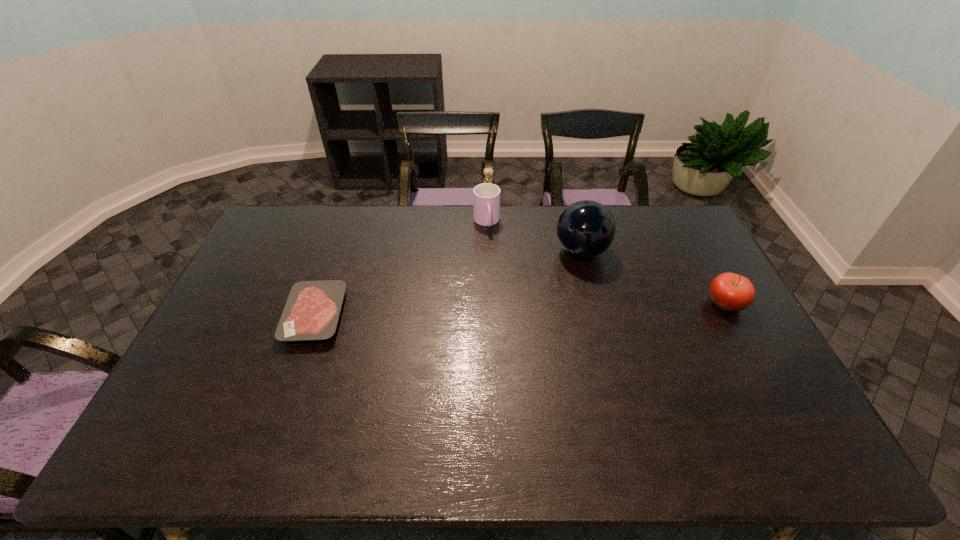
Find the location of `blank space located with the handle on the side of the third object from right to left`. blank space located with the handle on the side of the third object from right to left is located at coordinates (500, 301).

Locate an element on the screen. The height and width of the screenshot is (540, 960). vacant region located 0.100m on the side of the bowling ball with the finger holes is located at coordinates (564, 287).

You are a GUI agent. You are given a task and a screenshot of the screen. Output one action in this format:
    pyautogui.click(x=<x>, y=<y>)
    Task: Click on the vacant position located 0.390m on the side of the bowling ball with the finger holes
    The image size is (960, 540).
    Given the screenshot: What is the action you would take?
    pyautogui.click(x=531, y=352)

Where is `vacant position located 0.120m on the side of the bowling ball with the finger holes`? The image size is (960, 540). vacant position located 0.120m on the side of the bowling ball with the finger holes is located at coordinates (562, 291).

Identify the location of cup located at the far edge. This screenshot has height=540, width=960. (486, 197).

Locate an element on the screen. Image resolution: width=960 pixels, height=540 pixels. bowling ball that is at the far edge is located at coordinates (585, 229).

Where is `object that is at the right edge`? object that is at the right edge is located at coordinates (730, 292).

Where is `free space at the far edge of the desktop`? The image size is (960, 540). free space at the far edge of the desktop is located at coordinates (340, 243).

Image resolution: width=960 pixels, height=540 pixels. In order to click on vacant space at the near edge of the desktop in this screenshot , I will do click(550, 388).

In the image, there is a desktop. What are the coordinates of `vacant space at the left edge` in the screenshot? It's located at (270, 274).